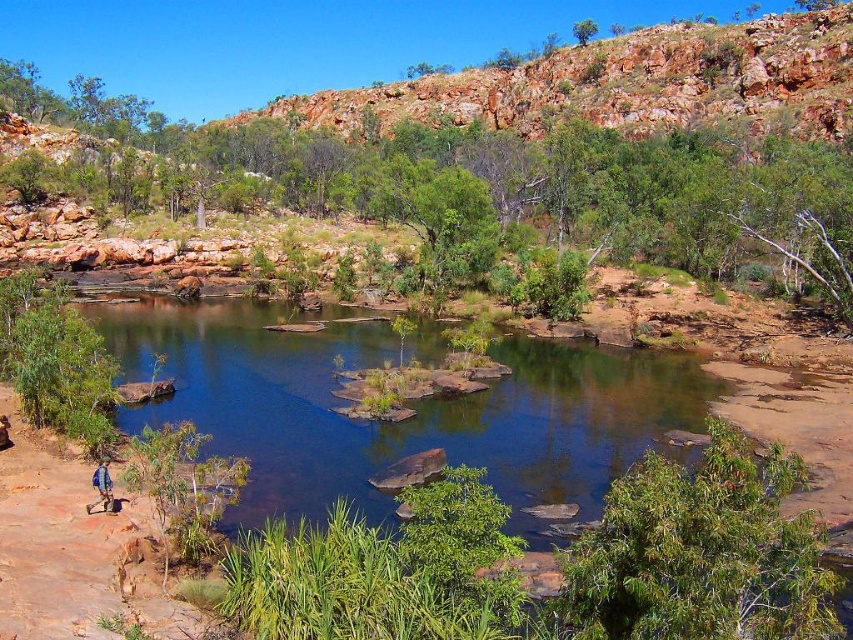
Image resolution: width=853 pixels, height=640 pixels. Identify the location of clear water at center. (403, 420).

Where is `clear water at center`? clear water at center is located at coordinates (403, 420).